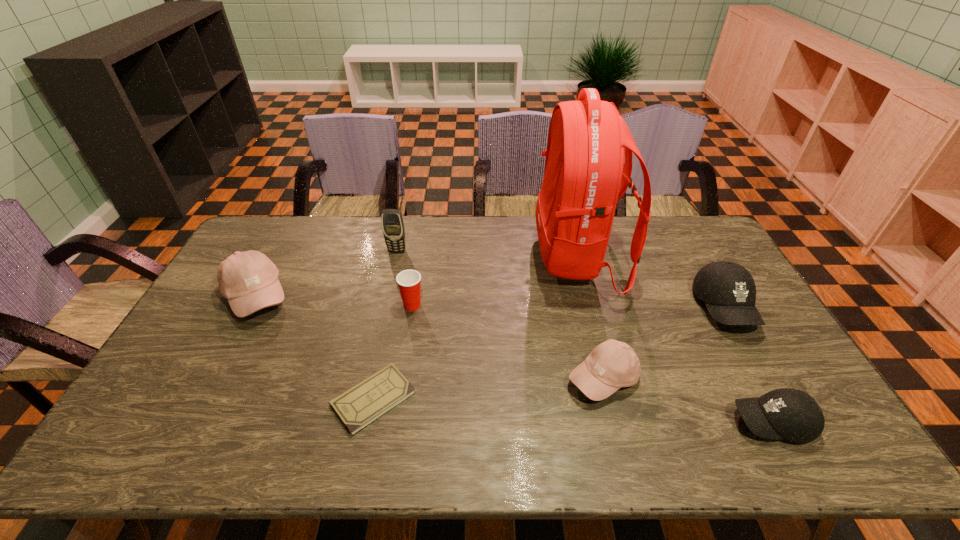
I want to click on free space located on the front-facing side of the nearer black baseball cap, so click(x=685, y=422).

Identify the location of vacant space located on the front-facing side of the nearer black baseball cap. This screenshot has width=960, height=540. (710, 422).

Identify the location of vacant space located 0.180m on the right of the shortest object. The width and height of the screenshot is (960, 540). (485, 399).

I want to click on backpack that is at the far edge, so click(x=585, y=175).

The image size is (960, 540). I want to click on cellular telephone that is at the far edge, so click(x=392, y=222).

I want to click on baseball cap present at the near edge, so click(791, 414).

Find the location of a particular element. The height and width of the screenshot is (540, 960). checkbook that is at the near edge is located at coordinates (361, 405).

What are the coordinates of `object that is at the left edge` in the screenshot? It's located at (249, 280).

This screenshot has width=960, height=540. What are the coordinates of `object that is at the near right corner` in the screenshot? It's located at (791, 414).

Locate an element on the screen. free space at the far edge of the desktop is located at coordinates (363, 242).